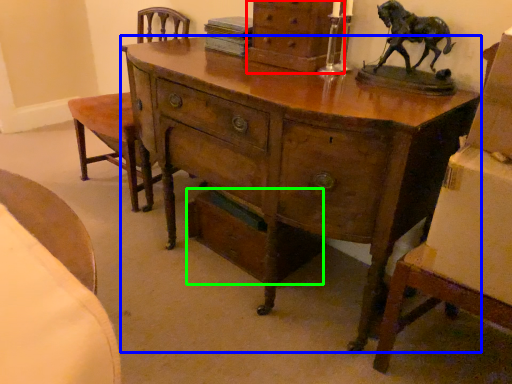
Question: Which object is positioned closest to chest of drawers (highlighted by a red box)? Select from desk (highlighted by a blue box) and drawer (highlighted by a green box).

Choices:
 (A) desk
 (B) drawer

Answer: (A)